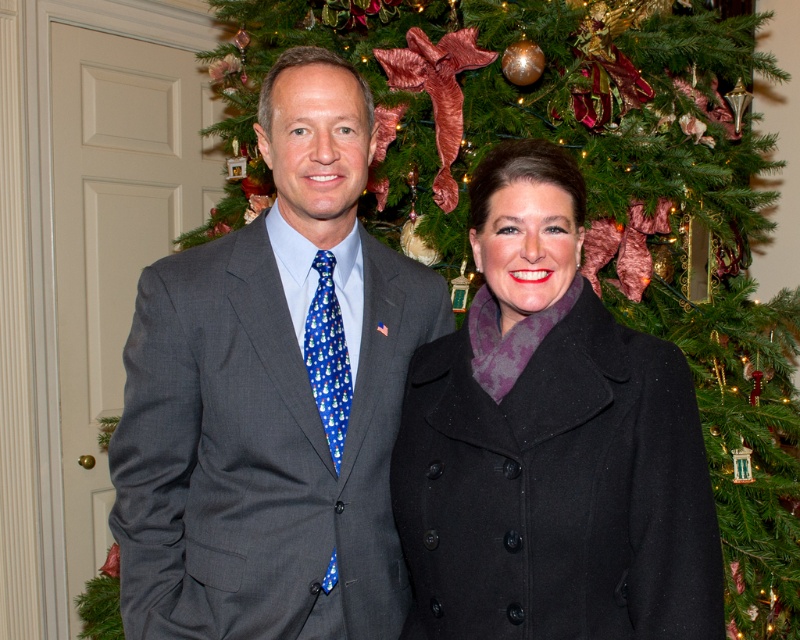
You are a photographer trying to capture a clear shot of the gray suit at center and the black wool coat at center. Since you want both subjects to be in focus, which one should you adjust your camera focus on first?

The black wool coat at center is behind the gray suit at center, so you should focus on the gray suit at center first to ensure both are in focus.

You are a photographer setting up for a group photo. You need to ensure that all clothing items are visible. Given that the gray suit at center and the black wool coat at center are both in the frame, which clothing item might require more space to avoid being cropped out?

The gray suit at center requires more space because its width surpasses that of the black wool coat at center, so it is wider and may need more room to avoid being cropped out.

You are a photographer setting up for a group photo. You need to position two subjects wearing the gray suit at center and the black wool coat at center. According to the scene, which subject should be placed on the left side of the photo?

The gray suit at center should be placed on the left side of the photo because the gray suit at center is to the left of the black wool coat at center in the scene.